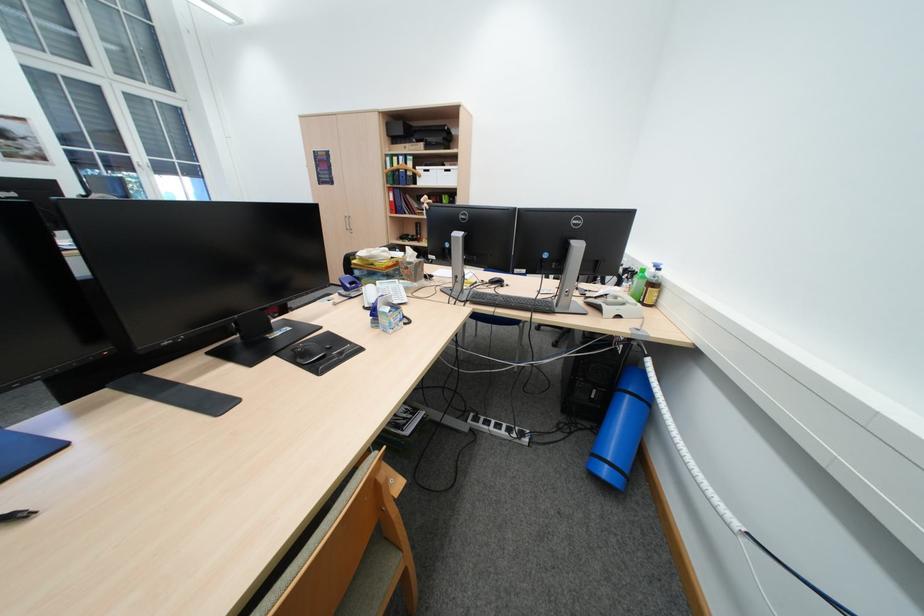
At what (x,y) coordinates should I click in order to perform the action: click on chair sitting surface. Please return your answer as a coordinate pair (x, y). Looking at the image, I should click on (379, 573).